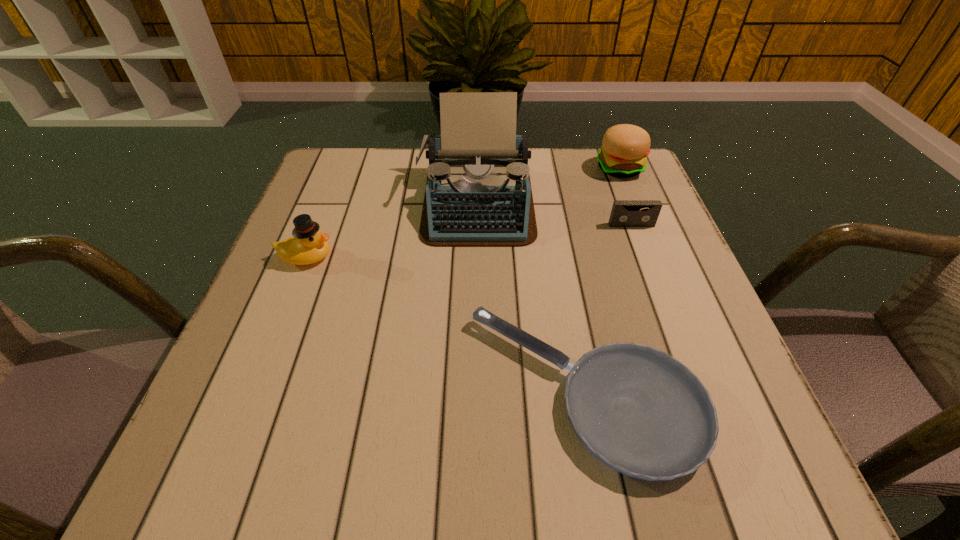
The height and width of the screenshot is (540, 960). What are the coordinates of `blank space located on the back of the frying pan` in the screenshot? It's located at (551, 207).

Where is `typewriter at the far edge`? This screenshot has width=960, height=540. typewriter at the far edge is located at coordinates (478, 193).

Where is `hamburger at the far edge`? hamburger at the far edge is located at coordinates tap(625, 147).

In order to click on object present at the near edge in this screenshot , I will do `click(643, 413)`.

Identify the location of object located in the left edge section of the desktop. (308, 245).

This screenshot has width=960, height=540. Identify the location of hamburger that is at the right edge. (625, 147).

Where is `videotape present at the right edge`? The image size is (960, 540). videotape present at the right edge is located at coordinates (625, 213).

Locate an element on the screen. frying pan present at the right edge is located at coordinates (643, 413).

Locate an element on the screen. object located in the far right corner section of the desktop is located at coordinates (625, 147).

Where is `object situated at the near right corner`? The width and height of the screenshot is (960, 540). object situated at the near right corner is located at coordinates (643, 413).